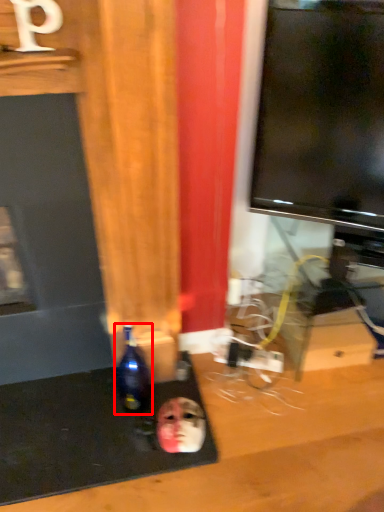
Question: Considering the relative positions of bottle (annotated by the red box) and human face in the image provided, where is bottle (annotated by the red box) located with respect to the staircase?

Choices:
 (A) right
 (B) left

Answer: (B)